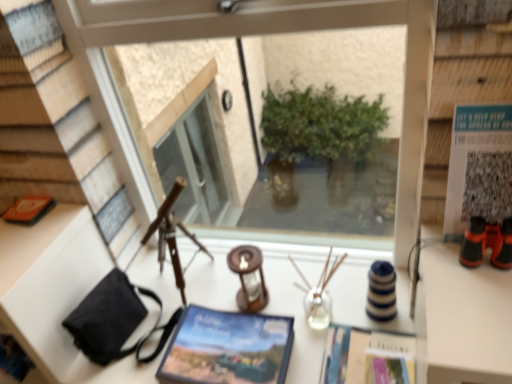
Question: Is white paper at upper right positioned with its back to translucent glass candle holder at center, the second candle holder positioned from the left?

Choices:
 (A) no
 (B) yes

Answer: (A)

Question: Considering the relative sizes of white paper at upper right and translucent glass candle holder at center, the second candle holder positioned from the left, in the image provided, is white paper at upper right thinner than translucent glass candle holder at center, the second candle holder positioned from the left,?

Choices:
 (A) yes
 (B) no

Answer: (A)

Question: Would you say translucent glass candle holder at center, the second candle holder positioned from the left, is part of white paper at upper right's contents?

Choices:
 (A) yes
 (B) no

Answer: (B)

Question: Does white paper at upper right have a greater width compared to translucent glass candle holder at center, the second candle holder positioned from the left?

Choices:
 (A) yes
 (B) no

Answer: (B)

Question: Can you confirm if white paper at upper right is positioned to the right of translucent glass candle holder at center, the second candle holder positioned from the left?

Choices:
 (A) no
 (B) yes

Answer: (B)

Question: Is point (320, 317) positioned closer to the camera than point (33, 221)?

Choices:
 (A) closer
 (B) farther

Answer: (A)

Question: Looking at the image, does translucent glass candle holder at center, which ranks as the 1th candle holder in right-to-left order, seem bigger or smaller compared to orange matte book at left?

Choices:
 (A) big
 (B) small

Answer: (A)

Question: From a real-world perspective, relative to orange matte book at left, is translucent glass candle holder at center, the second candle holder positioned from the left, vertically above or below?

Choices:
 (A) above
 (B) below

Answer: (B)

Question: Is translucent glass candle holder at center, the second candle holder positioned from the left, taller or shorter than orange matte book at left?

Choices:
 (A) short
 (B) tall

Answer: (B)

Question: Which is correct: orange matte book at left is inside white paper at upper right, or outside of it?

Choices:
 (A) outside
 (B) inside

Answer: (A)

Question: In terms of size, does orange matte book at left appear bigger or smaller than white paper at upper right?

Choices:
 (A) small
 (B) big

Answer: (A)

Question: From the image's perspective, relative to white paper at upper right, is orange matte book at left above or below?

Choices:
 (A) above
 (B) below

Answer: (B)

Question: From a real-world perspective, relative to white paper at upper right, is orange matte book at left vertically above or below?

Choices:
 (A) below
 (B) above

Answer: (A)

Question: Does point (331, 357) appear closer or farther from the camera than point (23, 220)?

Choices:
 (A) farther
 (B) closer

Answer: (B)

Question: Looking at their shapes, would you say matte paper magazine at center, the first magazine positioned from the right, is wider or thinner than orange matte book at left?

Choices:
 (A) thin
 (B) wide

Answer: (B)